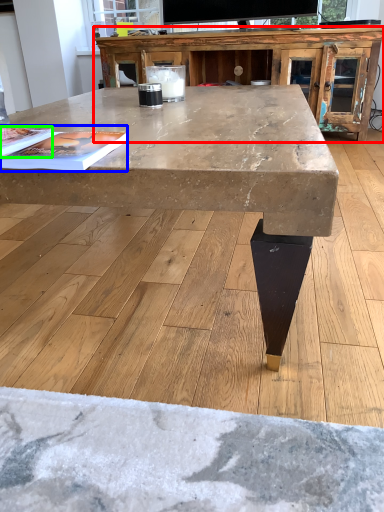
Question: Considering the real-world distances, which object is farthest from entertainment center (highlighted by a red box)? magazine (highlighted by a blue box) or magazine (highlighted by a green box)?

Choices:
 (A) magazine
 (B) magazine

Answer: (B)